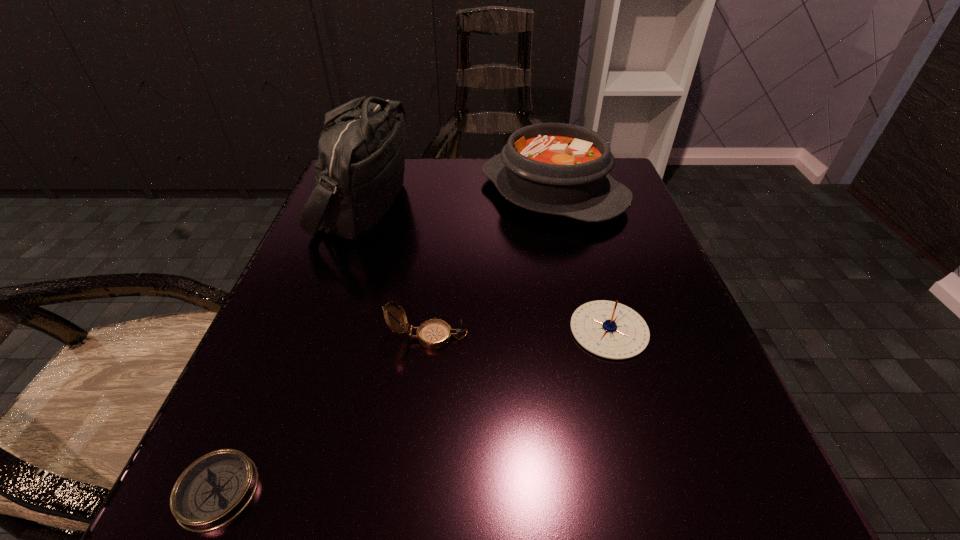
The width and height of the screenshot is (960, 540). What are the coordinates of `shoulder bag` in the screenshot? It's located at (360, 169).

Where is `casserole`? The height and width of the screenshot is (540, 960). casserole is located at coordinates (562, 169).

The height and width of the screenshot is (540, 960). What are the coordinates of `the third object from right to left` in the screenshot? It's located at [433, 334].

Where is `the rightmost compass`? the rightmost compass is located at coordinates (608, 329).

Find the location of `the shortest compass`. the shortest compass is located at coordinates (216, 488).

In order to click on the shortest object in this screenshot , I will do `click(216, 488)`.

At what (x,y) coordinates should I click in order to perform the action: click on free space located at the front padded panel of the tallest object. Please return your answer as a coordinate pair (x, y). Looking at the image, I should click on (475, 205).

You are a GUI agent. You are given a task and a screenshot of the screen. Output one action in this format:
    pyautogui.click(x=<x>, y=<y>)
    Task: Click on the vacant area located on the front of the casserole
    The height and width of the screenshot is (540, 960).
    Given the screenshot: What is the action you would take?
    pyautogui.click(x=583, y=323)

Where is `free point located 0.320m on the face of the second compass from right to left`? free point located 0.320m on the face of the second compass from right to left is located at coordinates (684, 336).

At what (x,y) coordinates should I click in order to perform the action: click on vacant space located 0.080m on the front of the rightmost compass. Please return your answer as a coordinate pair (x, y). Looking at the image, I should click on (633, 411).